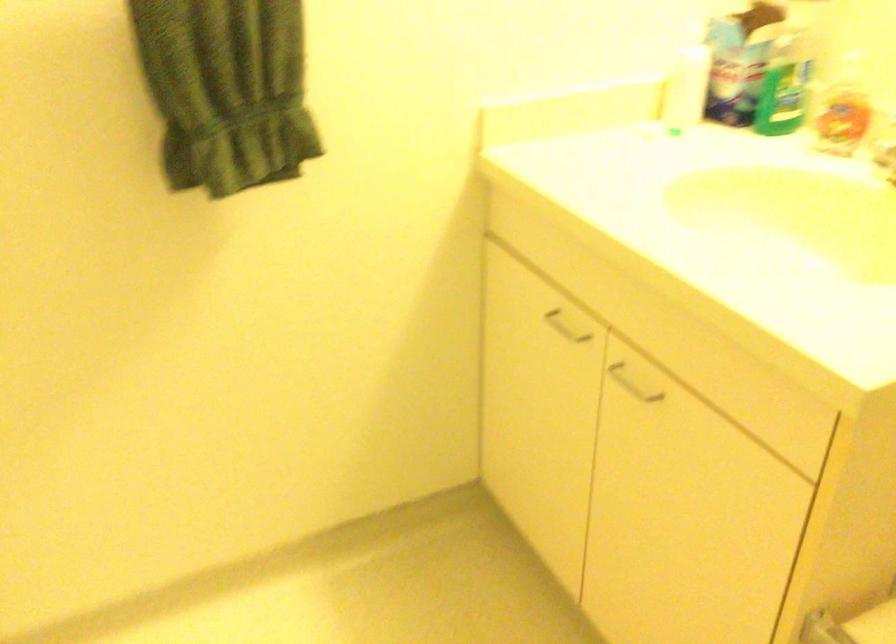
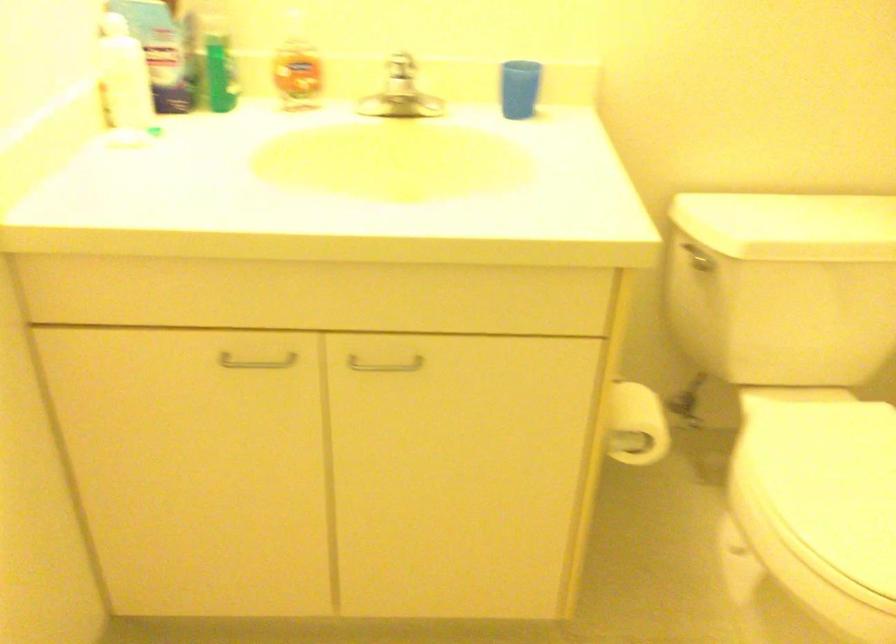
Based on the continuous images, in which direction is the camera rotating?

The camera's rotation is toward right-down.